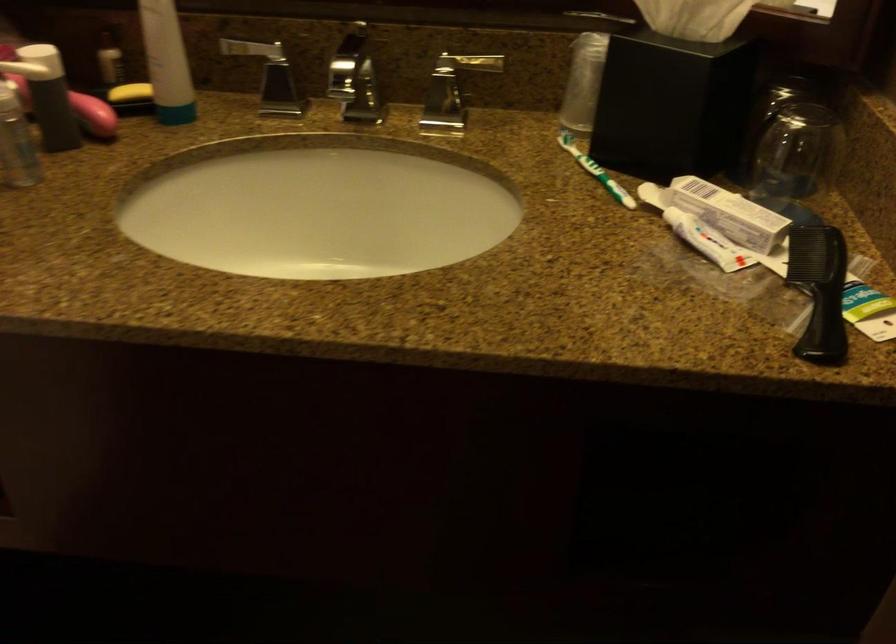
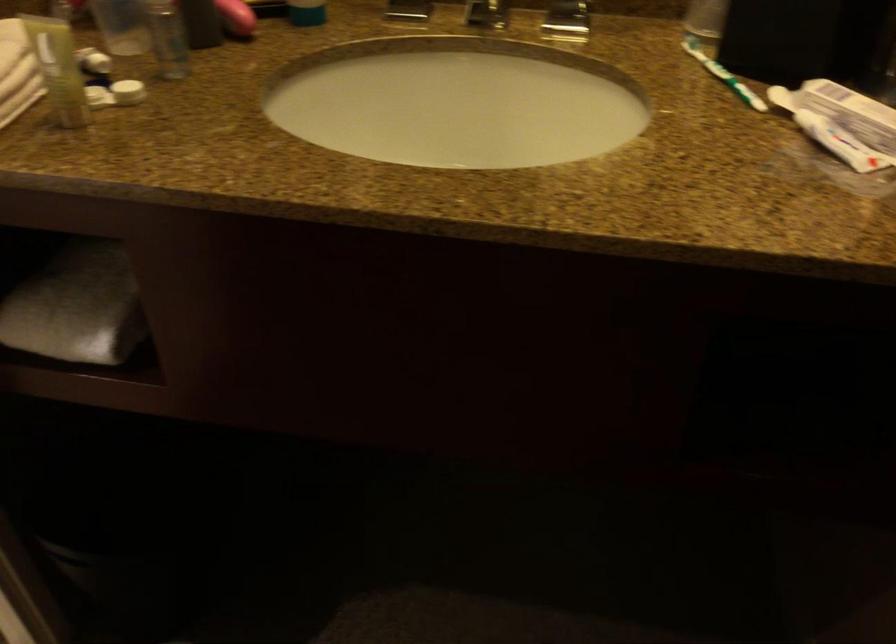
Find the pixel in the second image that matches [174,111] in the first image.

(306, 13)